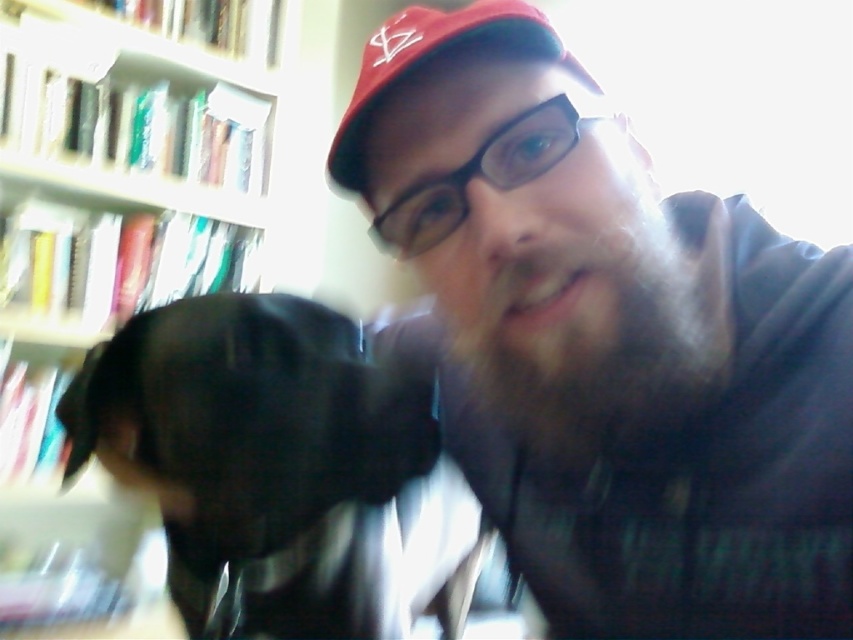
Does wooden bookshelf at left come behind red matte baseball cap at upper center?

Yes, it is.

What do you see at coordinates (129, 160) in the screenshot? Image resolution: width=853 pixels, height=640 pixels. I see `wooden bookshelf at left` at bounding box center [129, 160].

Where is `wooden bookshelf at left`? wooden bookshelf at left is located at coordinates (129, 160).

Does red matte baseball cap at upper center appear over matte skin nose at center?

Yes, red matte baseball cap at upper center is above matte skin nose at center.

Where is `red matte baseball cap at upper center`? This screenshot has height=640, width=853. red matte baseball cap at upper center is located at coordinates (431, 61).

This screenshot has height=640, width=853. In order to click on red matte baseball cap at upper center in this screenshot , I will do `click(431, 61)`.

Identify the location of matte black dog at lower left. The width and height of the screenshot is (853, 640). (611, 346).

Between matte black dog at lower left and red matte baseball cap at upper center, which one appears on the right side from the viewer's perspective?

Positioned to the right is matte black dog at lower left.

Which is behind, point (548, 61) or point (347, 180)?

The point (347, 180) is behind.

Find the location of a particular element. matte black dog at lower left is located at coordinates (611, 346).